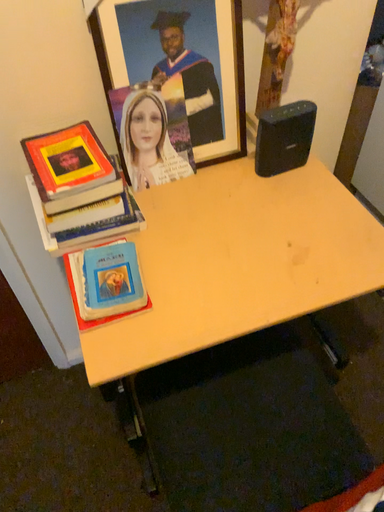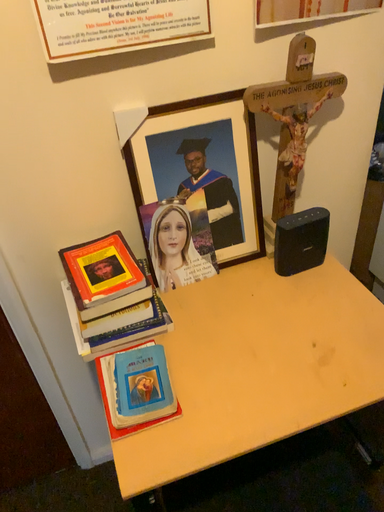
Question: Which way did the camera rotate in the video?

Choices:
 (A) rotated downward
 (B) rotated upward

Answer: (B)